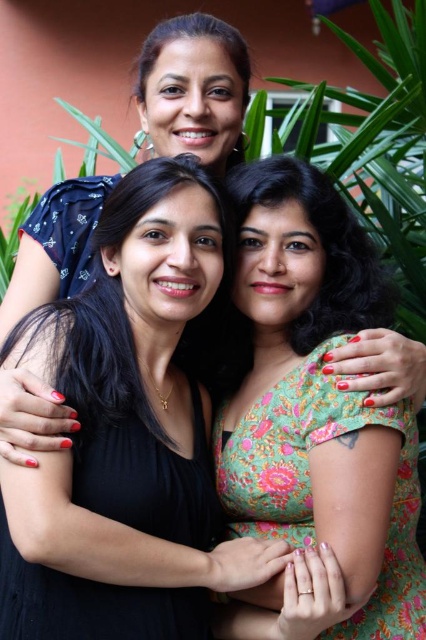
Question: In this image, where is black matte dress at center located relative to matte blue dress at upper left?

Choices:
 (A) left
 (B) right

Answer: (A)

Question: Which point is closer to the camera taking this photo?

Choices:
 (A) (176, 84)
 (B) (169, 483)
 (C) (299, 448)

Answer: (B)

Question: Can you confirm if black matte dress at center is positioned below matte blue dress at upper left?

Choices:
 (A) yes
 (B) no

Answer: (A)

Question: Estimate the real-world distances between objects in this image. Which object is farther from the black matte dress at center?

Choices:
 (A) floral fabric dress at center
 (B) matte blue dress at upper left

Answer: (B)

Question: Among these points, which one is nearest to the camera?

Choices:
 (A) (37, 637)
 (B) (411, 566)

Answer: (A)

Question: Does matte blue dress at upper left appear on the left side of floral fabric dress at center?

Choices:
 (A) yes
 (B) no

Answer: (A)